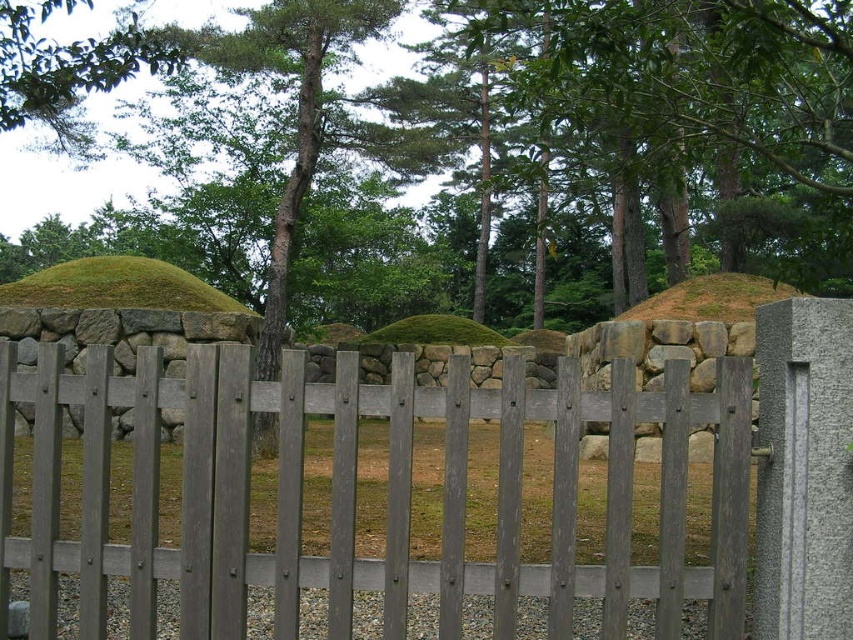
You are standing in the traditional Japanese garden and want to locate the gray wood fence at center. According to the coordinates provided, where should you look?

The gray wood fence at center is located at point (x=355, y=493).

You are standing in front of the wooden picket fence in the Japanese garden scene. You notice two points marked in the image. The first point is at coordinates point (x=293, y=636) and the second is at point (x=546, y=458). Which of these points is nearer to you as you face the fence?

Point (x=293, y=636) is closer to the viewer than point (x=546, y=458), so the first point is nearer to you.

You are a delivery person carrying a package that is 10 feet long. You need to pass through the gap between the gray wood fence at center and the concrete pillar on the right side. Will the package fit through the gap?

The gap between the gray wood fence at center and the concrete pillar on the right side is 11.15 feet, which is wider than the 10 feet long package. Therefore, the package will fit through the gap.